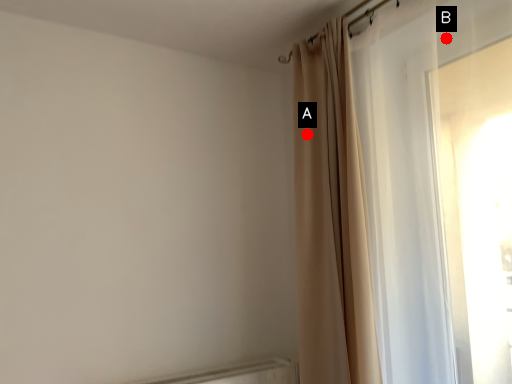
Question: Two points are circled on the image, labeled by A and B beside each circle. Which of the following is the farthest from the observer?

Choices:
 (A) A is further
 (B) B is further

Answer: (A)